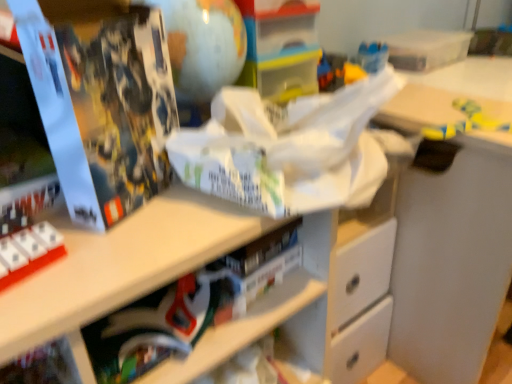
You are a GUI agent. You are given a task and a screenshot of the screen. Output one action in this format:
    pyautogui.click(x=<x>, y=<y>)
    Task: Click on the matte black book at lower center
    The width and height of the screenshot is (512, 384).
    Given the screenshot: What is the action you would take?
    (184, 310)

What do you see at coordinates (466, 122) in the screenshot? This screenshot has height=384, width=512. I see `yellow matte toy at upper right` at bounding box center [466, 122].

Find the location of a particular element. The image size is (512, 384). matte black book at lower center is located at coordinates (184, 310).

In the image, is yellow matte toy at upper right on the left side or the right side of matte black book at lower center?

yellow matte toy at upper right is to the right of matte black book at lower center.

From the image's perspective, which is below, yellow matte toy at upper right or matte black book at lower center?

Result: matte black book at lower center is shown below in the image.

Is yellow matte toy at upper right positioned beyond the bounds of matte black book at lower center?

yellow matte toy at upper right is positioned outside matte black book at lower center.

In the scene shown: Is yellow matte toy at upper right turned away from matte black book at lower center?

No, yellow matte toy at upper right is not facing the opposite direction of matte black book at lower center.

Is matte black book at lower center thinner than matte black book at left?

No.

Is matte black book at lower center at the left side of matte black book at left?

No, matte black book at lower center is not to the left of matte black book at left.

From the image's perspective, which one is positioned higher, matte black book at lower center or matte black book at left?

matte black book at left, from the image's perspective.

Is matte black book at lower center with matte black book at left?

No, matte black book at lower center is not in contact with matte black book at left.

Is point (120, 60) closer to camera compared to point (448, 133)?

Yes, point (120, 60) is closer to viewer.

From the image's perspective, is matte black book at left on yellow matte toy at upper right?

Actually, matte black book at left appears below yellow matte toy at upper right in the image.

Which object is further away from the camera, matte black book at left or yellow matte toy at upper right?

Positioned behind is yellow matte toy at upper right.

Is matte black book at left further to the viewer compared to matte black book at lower center?

No, matte black book at left is closer to the viewer.

From the image's perspective, between matte black book at left and matte black book at lower center, who is located below?

matte black book at lower center, from the image's perspective.

Looking at this image, considering the sizes of matte black book at left and matte black book at lower center in the image, is matte black book at left bigger or smaller than matte black book at lower center?

Clearly, matte black book at left is larger in size than matte black book at lower center.

Would you say matte black book at left is a long distance from matte black book at lower center?

Actually, matte black book at left and matte black book at lower center are a little close together.

From the image's perspective, which object appears higher, matte black book at lower center or yellow matte toy at upper right?

yellow matte toy at upper right, from the image's perspective.

Is yellow matte toy at upper right a part of matte black book at lower center?

Definitely not — yellow matte toy at upper right is not inside matte black book at lower center.

Does matte black book at lower center have a smaller size compared to yellow matte toy at upper right?

No, matte black book at lower center is not smaller than yellow matte toy at upper right.

Is matte black book at lower center aimed at yellow matte toy at upper right?

No, matte black book at lower center is not facing towards yellow matte toy at upper right.

Where is `toy directly beneath the matte black book at left (from a real-world perspective)`? toy directly beneath the matte black book at left (from a real-world perspective) is located at coordinates (466, 122).

Between yellow matte toy at upper right and matte black book at left, which one has larger width?

With larger width is yellow matte toy at upper right.

Which is behind, point (465, 124) or point (85, 17)?

The point (465, 124) is behind.

Which of these two, yellow matte toy at upper right or matte black book at left, stands shorter?

With less height is yellow matte toy at upper right.

Identify the location of book below the yellow matte toy at upper right (from the image's perspective). (184, 310).

You are a GUI agent. You are given a task and a screenshot of the screen. Output one action in this format:
    pyautogui.click(x=<x>, y=<y>)
    Task: Click on the book that is behind the matte black book at left
    
    Given the screenshot: What is the action you would take?
    pyautogui.click(x=184, y=310)

Based on the photo, which object lies nearer to the anchor point yellow matte toy at upper right, matte black book at left or matte black book at lower center?

The object closer to yellow matte toy at upper right is matte black book at lower center.

Considering their positions, is matte black book at left positioned closer to matte black book at lower center than yellow matte toy at upper right?

matte black book at left.

When comparing their distances from matte black book at left, does yellow matte toy at upper right or matte black book at lower center seem further?

yellow matte toy at upper right is further to matte black book at left.

When comparing their distances from matte black book at lower center, does yellow matte toy at upper right or matte black book at left seem closer?

matte black book at left is closer to matte black book at lower center.

Estimate the real-world distances between objects in this image. Which object is closer to matte black book at left, matte black book at lower center or yellow matte toy at upper right?

matte black book at lower center lies closer to matte black book at left than the other object.

When comparing their distances from yellow matte toy at upper right, does matte black book at lower center or matte black book at left seem closer?

matte black book at lower center is closer to yellow matte toy at upper right.

You are a GUI agent. You are given a task and a screenshot of the screen. Output one action in this format:
    pyautogui.click(x=<x>, y=<y>)
    Task: Click on the book located between matte black book at left and yellow matte toy at upper right in the left-right direction
    The image size is (512, 384).
    Given the screenshot: What is the action you would take?
    pyautogui.click(x=184, y=310)